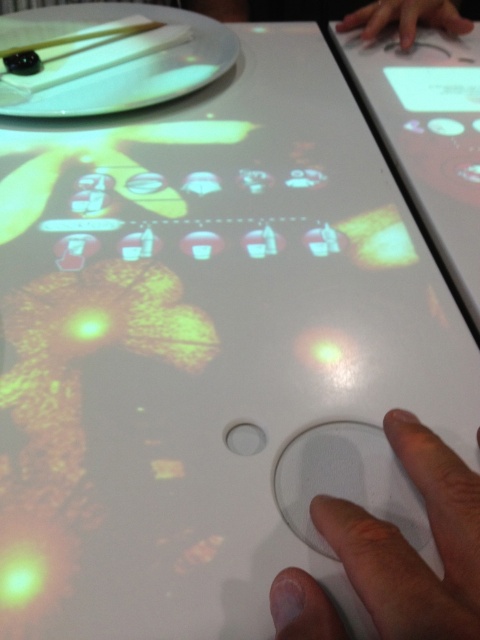
You are a visitor at the interactive exhibit. You see a transparent plastic hand at bottom right and a smooth skin hand at upper right. How far apart are they?

The transparent plastic hand at bottom right is 36.01 inches away from the smooth skin hand at upper right.

You are designing an interactive exhibit and need to place a new button on the table surface. The current touchpad is at point (411, 547). Where should you place the new button to ensure it is not obscured by the hand when it presses the touchpad?

The transparent plastic hand at bottom right is located at point (411, 547). To avoid obstruction, place the new button away from this point, perhaps in an area where the hand isn not interacting, like the upper left quadrant of the table surface.

You are designing an interactive exhibit and need to ensure that both the transparent plastic hand at bottom right and the smooth skin hand at upper right can be easily accessed by visitors. Based on their sizes, which hand might require more space for comfortable interaction?

The smooth skin hand at upper right requires more space for comfortable interaction since it occupies more space than the transparent plastic hand at bottom right.